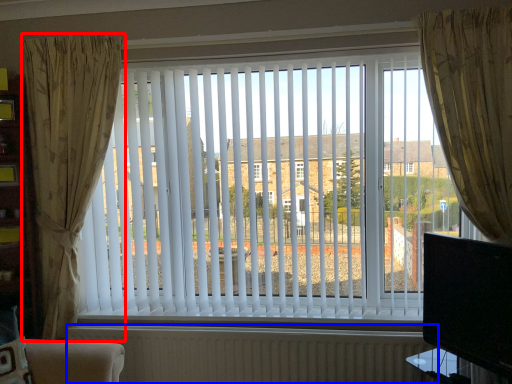
Question: Which object is further to the camera taking this photo, curtain (highlighted by a red box) or radiator (highlighted by a blue box)?

Choices:
 (A) curtain
 (B) radiator

Answer: (B)